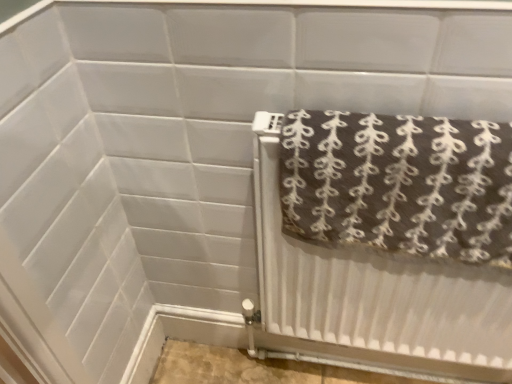
Identify the location of vacant space situated above brown textured towel at right (from a real-world perspective). The height and width of the screenshot is (384, 512). (412, 118).